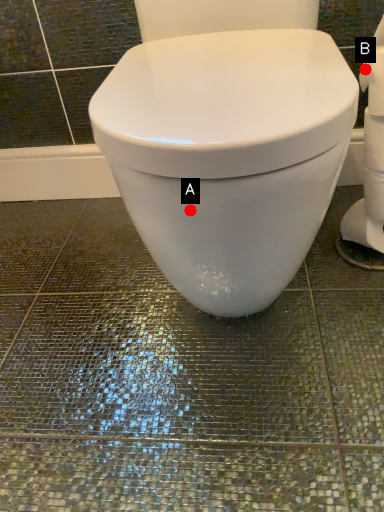
Question: Two points are circled on the image, labeled by A and B beside each circle. Which point is closer to the camera taking this photo?

Choices:
 (A) A is closer
 (B) B is closer

Answer: (A)